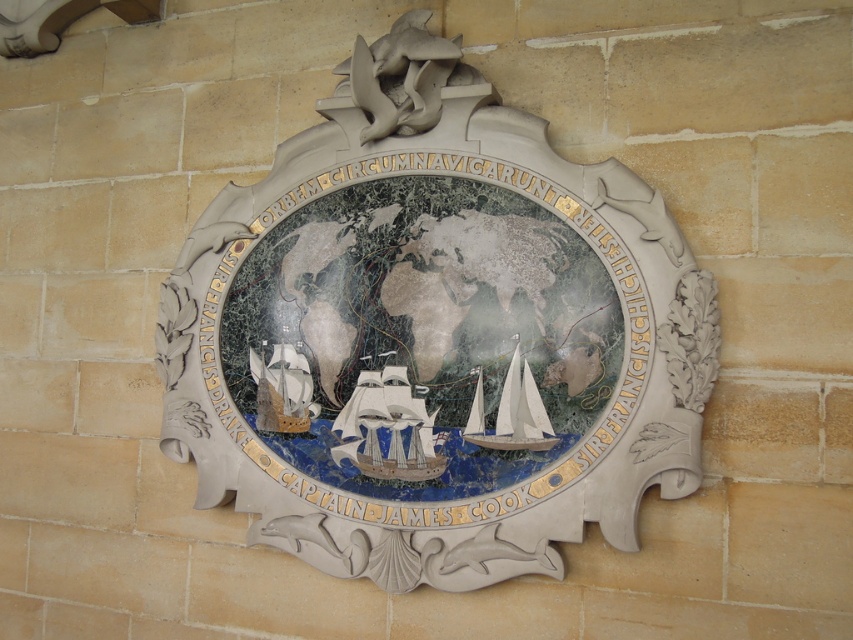
You are an art conservator examining the plaque. You need to determine which of the two ships, the blue glossy ship at center or the white glossy sailboat at center, requires more vertical space for restoration. Based on their positions on the plaque, which one would you prioritize?

The blue glossy ship at center has a greater height compared to the white glossy sailboat at center, so it would require more vertical space for restoration and should be prioritized.

You are an art conservator examining the plaque. You notice a point marked at coordinates (x=438, y=326). What does this point correspond to on the plaque?

The point at coordinates (x=438, y=326) corresponds to the marble relief map at center.